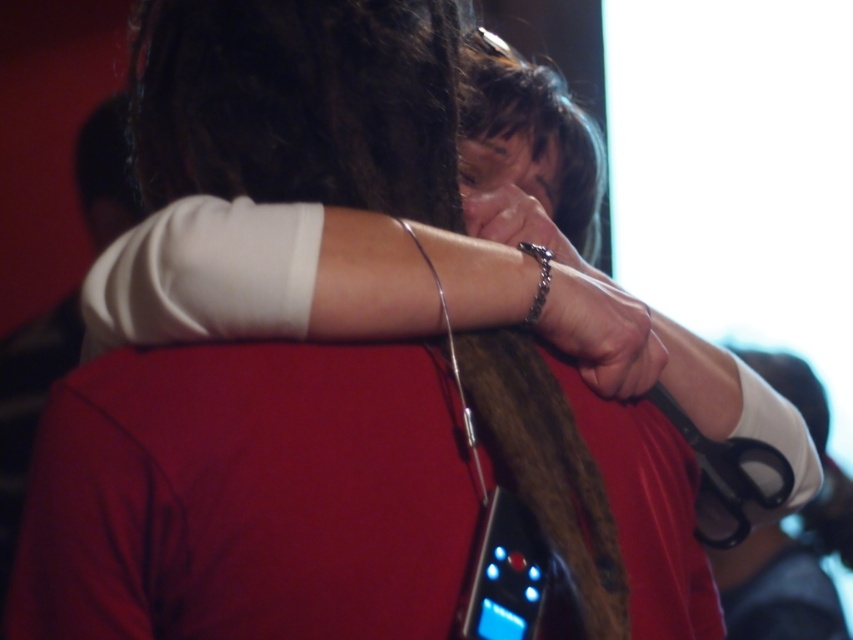
You are an observer standing in front of the scene. You notice two points in the image, one at coordinates point (614, 294) and the other at point (544, 291). Based on your perspective, which point is closer to you?

Point (544, 291) is closer to you because it is in front of point (614, 294).

You are an observer standing in front of the scene. You notice the white matte arm at center and the silver metallic chain at upper center. Which object is positioned more to the left?

The white matte arm at center is positioned more to the left than the silver metallic chain at upper center.

You are an artist trying to sketch this scene. When drawing the silver chain bracelet at upper center and the metallic bracelet at center, which one should you draw first to maintain the correct spatial relationship?

You should draw the silver chain bracelet at upper center first because it is closer to the viewer than the metallic bracelet at center, so it should appear in front.